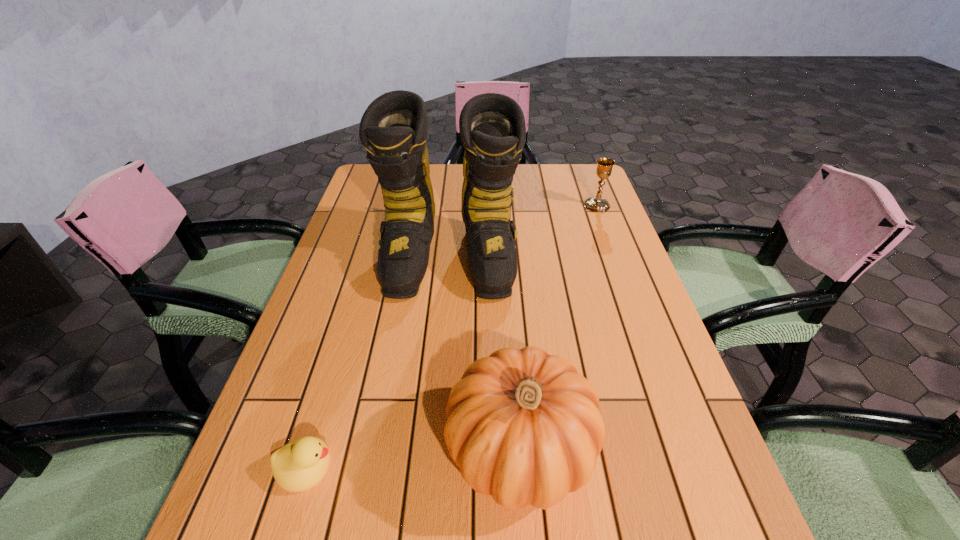
Identify the location of object present at the far edge. (604, 165).

What are the coordinates of `ski boots that is positioned at the left edge` in the screenshot? It's located at (393, 129).

I want to click on duckling present at the left edge, so 298,466.

The width and height of the screenshot is (960, 540). I want to click on object at the right edge, so click(x=604, y=165).

This screenshot has width=960, height=540. Find the location of `object situated at the far right corner`. object situated at the far right corner is located at coordinates (604, 165).

Where is `vacant area at the far edge`? The height and width of the screenshot is (540, 960). vacant area at the far edge is located at coordinates (551, 185).

In the image, there is a desktop. Where is `free space at the left edge`? The image size is (960, 540). free space at the left edge is located at coordinates 250,493.

In the image, there is a desktop. Identify the location of vacant space at the right edge. This screenshot has width=960, height=540. (609, 385).

The height and width of the screenshot is (540, 960). What are the coordinates of `vacant space at the far right corner` in the screenshot? It's located at (579, 166).

Find the location of a particular element. The height and width of the screenshot is (540, 960). vacant point located between the duckling and the farthest object is located at coordinates pos(451,336).